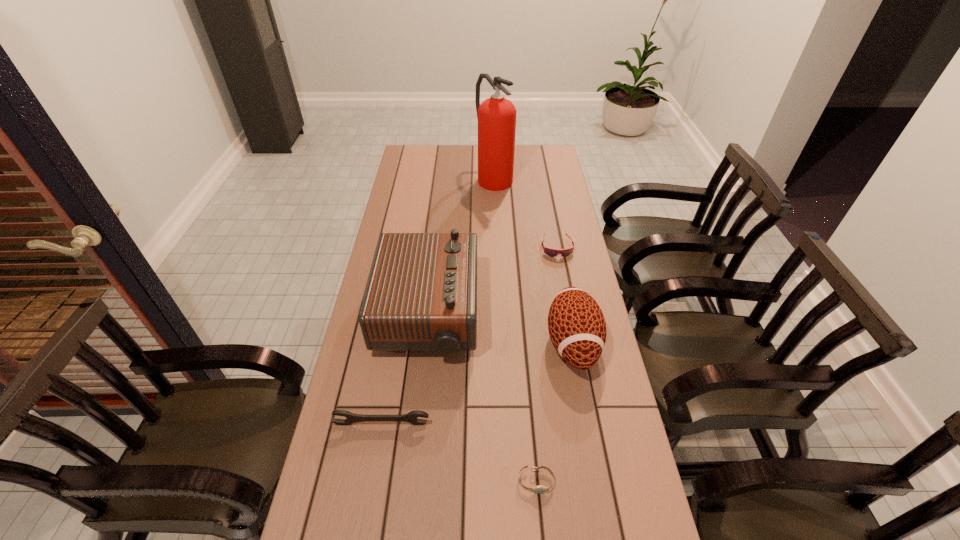
Locate an element on the screen. Image resolution: width=960 pixels, height=540 pixels. vacant space in between the fire extinguisher and the watch is located at coordinates (515, 329).

Select which object appears as the second closest to the football. Please provide its 2D coordinates. Your answer should be formatted as a tuple, i.e. [(x, y)], where the tuple contains the x and y coordinates of a point satisfying the conditions above.

[(536, 489)]

Select which object appears as the second closest to the watch. Please provide its 2D coordinates. Your answer should be formatted as a tuple, i.e. [(x, y)], where the tuple contains the x and y coordinates of a point satisfying the conditions above.

[(412, 417)]

You are a GUI agent. You are given a task and a screenshot of the screen. Output one action in this format:
    pyautogui.click(x=<x>, y=<y>)
    Task: Click on the blank area in the image that satisfies the following two spatial constraints: 1. on the tuning display of the radio receiver; 2. on the left side of the football
    
    Given the screenshot: What is the action you would take?
    pyautogui.click(x=424, y=343)